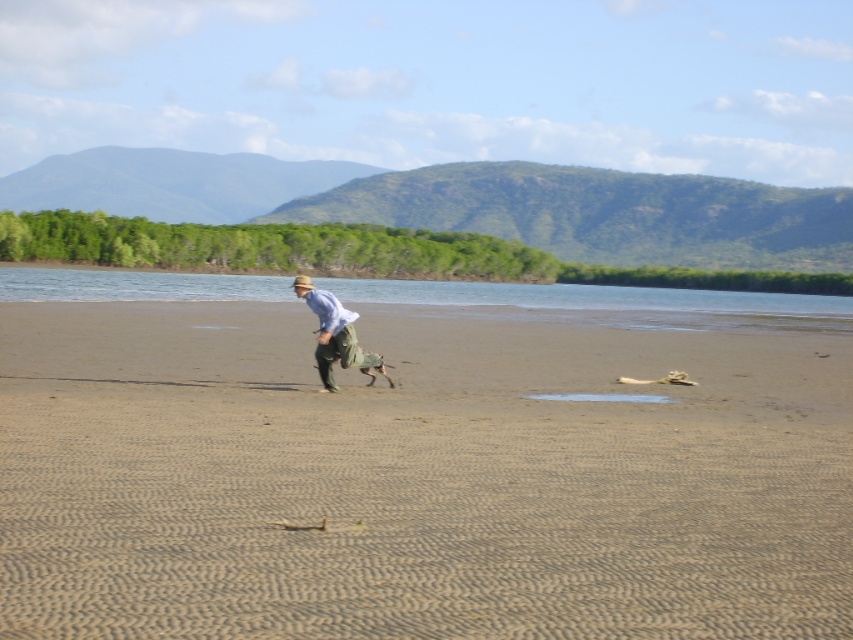
Question: Does brown sandy beach at center appear under clear blue water at center?

Choices:
 (A) yes
 (B) no

Answer: (A)

Question: Does brown sandy beach at center appear under light blue cotton shirt at center?

Choices:
 (A) yes
 (B) no

Answer: (A)

Question: Among these objects, which one is farthest from the camera?

Choices:
 (A) light blue cotton shirt at center
 (B) clear blue water at center

Answer: (B)

Question: Which point is farther from the camera taking this photo?

Choices:
 (A) (325, 305)
 (B) (354, 436)
 (C) (212, 275)

Answer: (C)

Question: Does clear blue water at center appear over light blue cotton shirt at center?

Choices:
 (A) yes
 (B) no

Answer: (A)

Question: Which of the following is the closest to the observer?

Choices:
 (A) (67, 586)
 (B) (380, 291)
 (C) (347, 317)

Answer: (A)